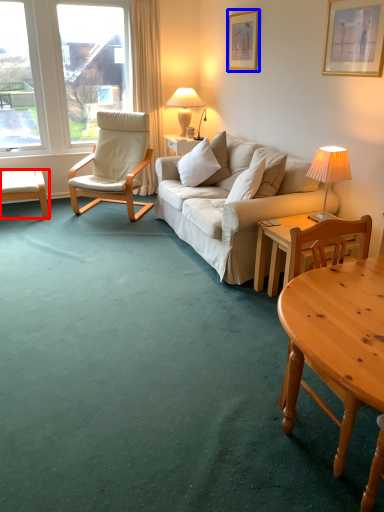
Question: Among these objects, which one is nearest to the camera, desk (highlighted by a red box) or picture frame (highlighted by a blue box)?

Choices:
 (A) desk
 (B) picture frame

Answer: (B)